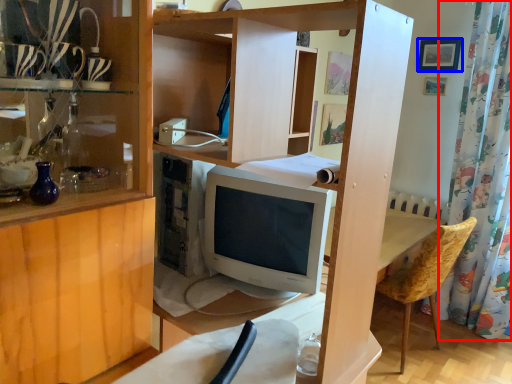
Question: Which object appears closest to the camera in this image, shower curtain (highlighted by a red box) or picture frame (highlighted by a blue box)?

Choices:
 (A) shower curtain
 (B) picture frame

Answer: (A)